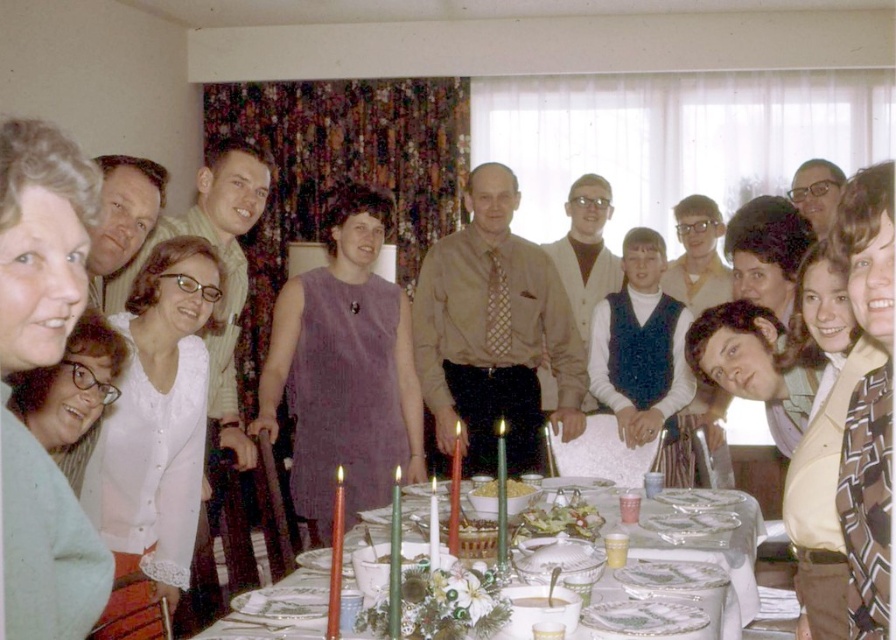
Question: Can you confirm if white lace cardigan at center is bigger than white glossy plates at center?

Choices:
 (A) no
 (B) yes

Answer: (A)

Question: Based on their relative distances, which object is nearer to the brown textured coat at lower right?

Choices:
 (A) white glossy plates at center
 (B) white lace cardigan at center

Answer: (A)

Question: Is brown textured coat at lower right above white matte bowl at center?

Choices:
 (A) no
 (B) yes

Answer: (B)

Question: Which of the following is the farthest from the observer?

Choices:
 (A) green leafy salad at center
 (B) white glossy plates at center
 (C) matte white blouse at upper left

Answer: (A)

Question: Can you confirm if matte white blouse at upper left is thinner than green leafy salad at center?

Choices:
 (A) yes
 (B) no

Answer: (A)

Question: Which of the following is the closest to the observer?

Choices:
 (A) white lace cardigan at center
 (B) green leafy salad at center
 (C) matte white blouse at lower left

Answer: (C)